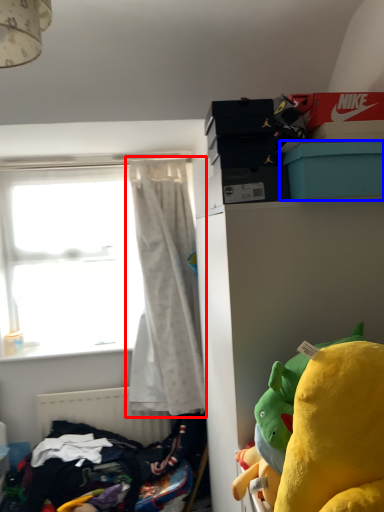
Question: Which point is closer to the camera, curtain (highlighted by a red box) or box (highlighted by a blue box)?

Choices:
 (A) curtain
 (B) box

Answer: (B)